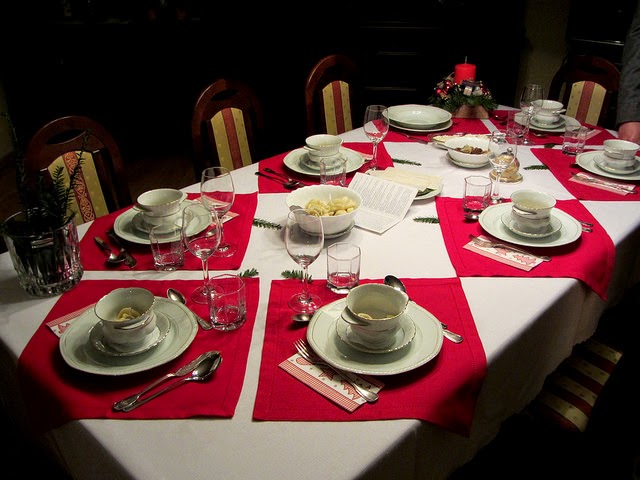
Where is `spoons`? This screenshot has width=640, height=480. spoons is located at coordinates (207, 375), (173, 296), (111, 262), (292, 187), (394, 282), (468, 219).